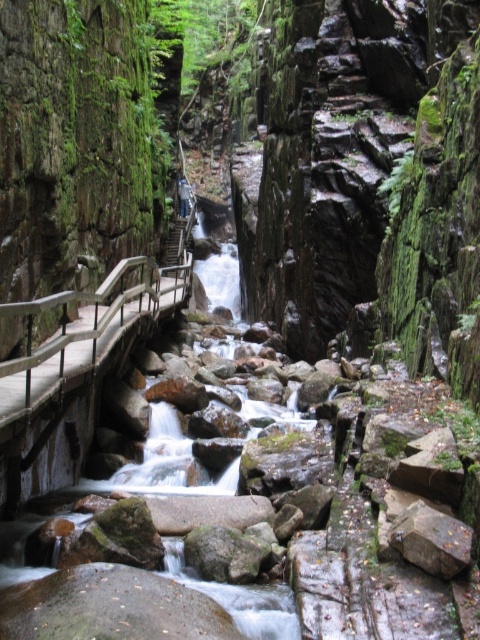
Based on the photo, you are a hiker standing on the wooden rail at left and want to cross to the smooth gray rock stream at center. Is the stream directly in front of you?

Yes, the smooth gray rock stream at center is directly in front of the wooden rail at left, so you can cross to it.